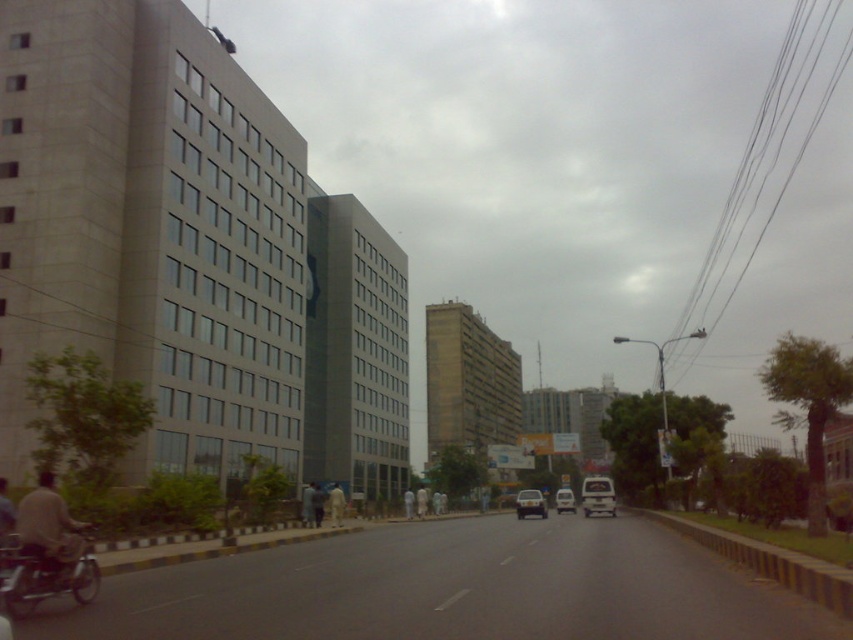
You are standing at the point with coordinates point (311, 497) and want to walk to the point with coordinates point (53, 572). Which direction should you move relative to your current position?

You should move forward because point (53, 572) is in front of point (311, 497).

You are a pedestrian standing at the edge of the road. You see a matte black car at center and dark blue jeans at center. Which object is closer to the ground?

The matte black car at center is closer to the ground because it is positioned below the dark blue jeans at center.

You are a delivery driver who needs to park your metallic silver motorcycle at lower left in a specific spot. The parking area is marked by a point at coordinate (45,573). Can you confirm if your motorcycle is already parked correctly at that point?

Yes, the point at coordinate (45,573) indicates that the metallic silver motorcycle at lower left is already parked correctly at that spot.